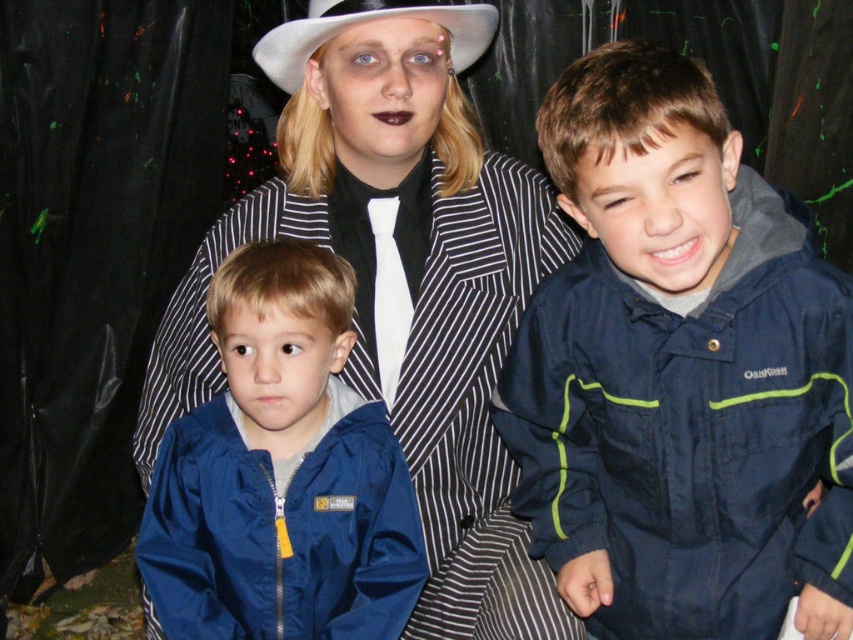
Between blue fabric jacket at left and white felt cowboy hat at upper center, which one has more height?

With more height is blue fabric jacket at left.

Which of these two, blue fabric jacket at left or white felt cowboy hat at upper center, stands shorter?

Standing shorter between the two is white felt cowboy hat at upper center.

Find the location of a particular element. This screenshot has width=853, height=640. blue fabric jacket at left is located at coordinates (399, 280).

Can you confirm if navy blue jacket at center is wider than blue fabric jacket at left?

In fact, navy blue jacket at center might be narrower than blue fabric jacket at left.

The image size is (853, 640). What do you see at coordinates (680, 372) in the screenshot? I see `navy blue jacket at center` at bounding box center [680, 372].

Identify the location of navy blue jacket at center. Image resolution: width=853 pixels, height=640 pixels. (680, 372).

Can you confirm if navy blue jacket at center is shorter than matte blue jacket at lower left?

In fact, navy blue jacket at center may be taller than matte blue jacket at lower left.

The height and width of the screenshot is (640, 853). Identify the location of navy blue jacket at center. (680, 372).

At what (x,y) coordinates should I click in order to perform the action: click on navy blue jacket at center. Please return your answer as a coordinate pair (x, y). The width and height of the screenshot is (853, 640). Looking at the image, I should click on (680, 372).

Find the location of `navy blue jacket at center`. navy blue jacket at center is located at coordinates (680, 372).